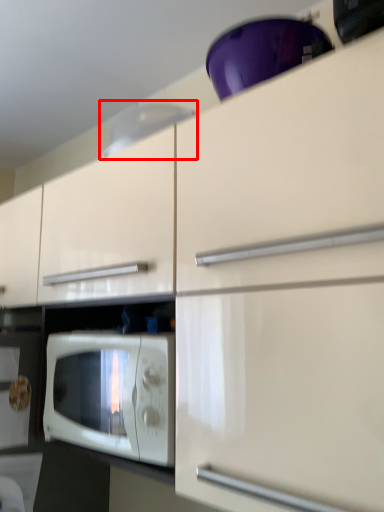
Question: From the image's perspective, what is the correct spatial relationship of exhaust hood (annotated by the red box) in relation to microwave oven?

Choices:
 (A) below
 (B) above

Answer: (B)